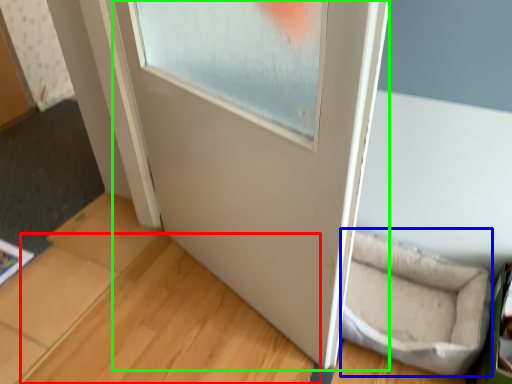
Question: Which is farther away from wood (highlighted by a red box)? wide (highlighted by a blue box) or door (highlighted by a green box)?

Choices:
 (A) wide
 (B) door

Answer: (A)